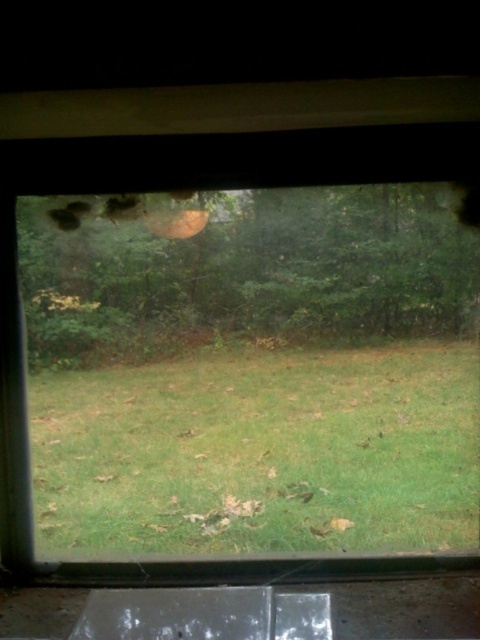
You are a passenger in the car and want to know which object is closer to you between the green grassy at center and the green matte tree at center. Which one is closer?

The green grassy at center is closer to you because it is further to the viewer than the green matte tree at center.

You are a passenger in a car and looking out the window. You see the green grassy at center and the green matte tree at center. Which one is more to the left?

The green matte tree at center is more to the left because the green grassy at center is positioned on the right side of it.

You are a passenger in a car and looking through the window. You see the green grassy at center and the green matte tree at center. Which one is closer to the bottom of the window?

The green grassy at center is closer to the bottom of the window because it is positioned below the green matte tree at center.